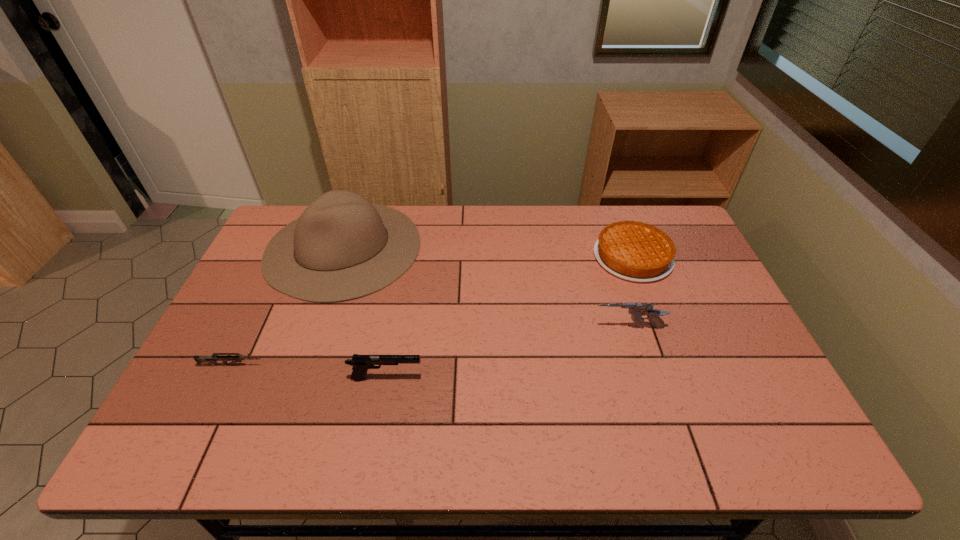
What are the coordinates of `sombrero` in the screenshot? It's located at (347, 248).

At what (x,y) coordinates should I click in order to perform the action: click on the rightmost gun. Please return your answer as a coordinate pair (x, y). Looking at the image, I should click on (637, 309).

In order to click on the third nearest object in this screenshot , I will do `click(637, 309)`.

The height and width of the screenshot is (540, 960). In order to click on the nearest object in this screenshot , I will do `click(361, 363)`.

I want to click on the nearest gun, so click(361, 363).

Find the location of a particular element. This screenshot has height=540, width=960. pie is located at coordinates (634, 251).

Image resolution: width=960 pixels, height=540 pixels. I want to click on the shortest gun, so click(213, 359).

In order to click on the shortest object in this screenshot , I will do `click(213, 359)`.

This screenshot has width=960, height=540. Identify the location of vacant space located 0.180m on the front of the sombrero. (307, 354).

The image size is (960, 540). What are the coordinates of `free space located at the barrel of the third farthest object` in the screenshot? It's located at (494, 328).